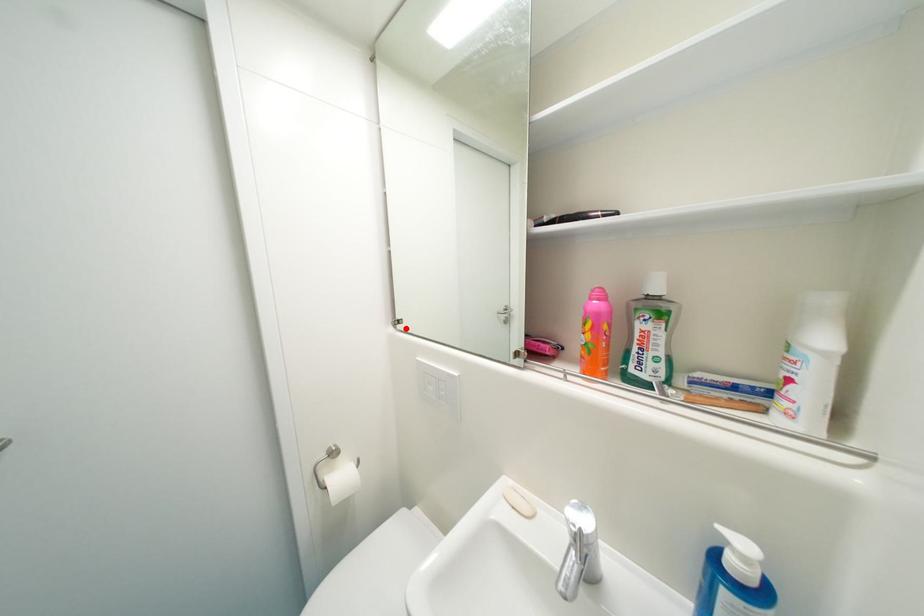
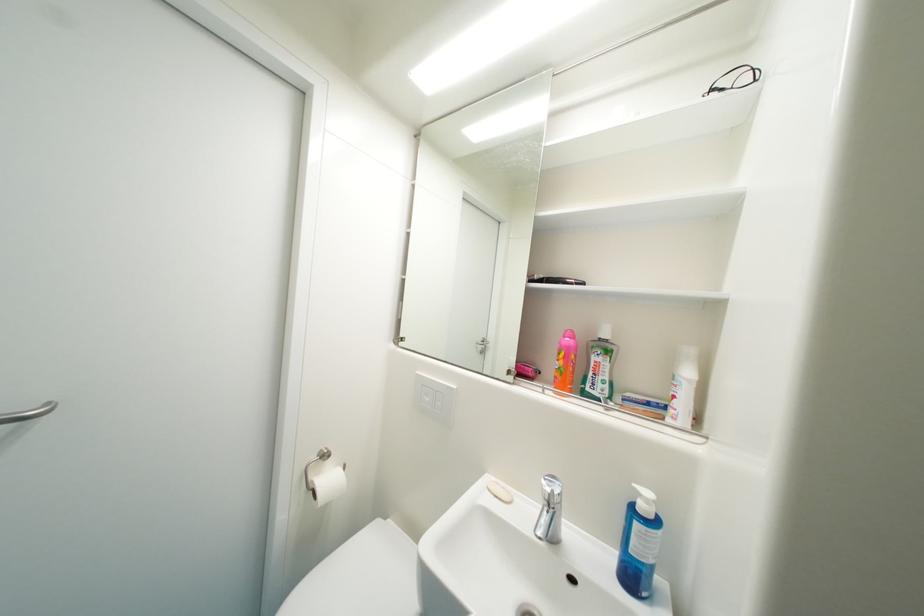
Where in the second image is the point corresponding to the highlighted location from the first image?

(407, 345)